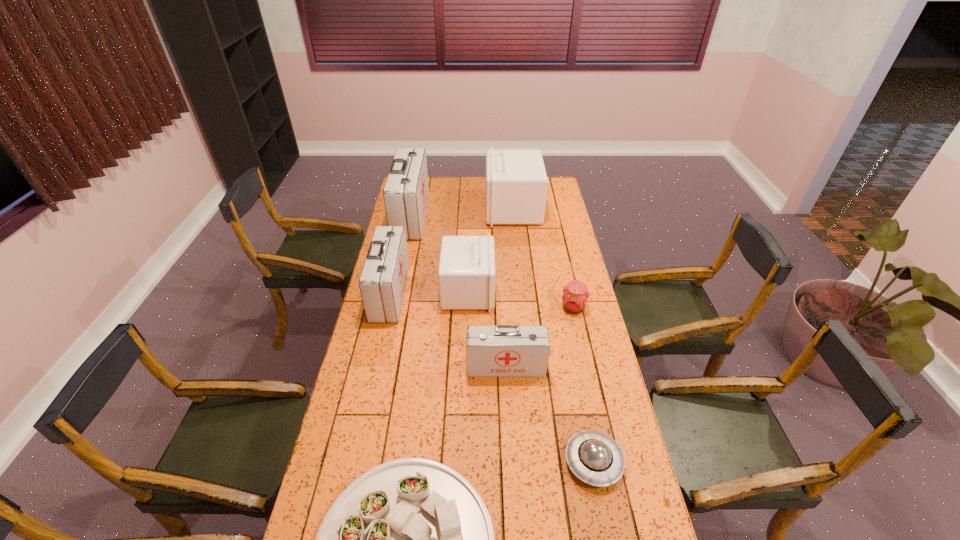
The height and width of the screenshot is (540, 960). Find the location of `saucer present at the right edge`. saucer present at the right edge is located at coordinates (594, 457).

Identify the location of object positioned at the far left corner. (406, 191).

You are a GUI agent. You are given a task and a screenshot of the screen. Output one action in this format:
    pyautogui.click(x=<x>, y=<y>)
    Task: Click on the object that is at the far right corner
    
    Given the screenshot: What is the action you would take?
    pyautogui.click(x=516, y=182)

In the image, there is a desktop. Where is `free region at the left edge`? Image resolution: width=960 pixels, height=540 pixels. free region at the left edge is located at coordinates (393, 354).

The image size is (960, 540). Find the location of `free space at the right edge of the desktop`. free space at the right edge of the desktop is located at coordinates (563, 220).

Image resolution: width=960 pixels, height=540 pixels. I want to click on free space that is in between the bigger white first-aid kit and the smallest red first-aid kit, so click(x=510, y=288).

Find the location of a particular element. The width and height of the screenshot is (960, 540). unoccupied area between the saucer and the third shortest object is located at coordinates (584, 385).

Locate an element on the screen. free space between the bigger white first-aid kit and the farthest red first-aid kit is located at coordinates (462, 212).

The width and height of the screenshot is (960, 540). I want to click on vacant space in between the bigger white first-aid kit and the jam, so click(543, 259).

Identify the location of vacant region between the saucer and the jam. pyautogui.click(x=584, y=385).